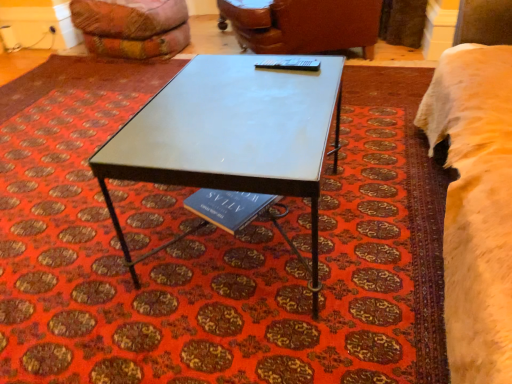
This screenshot has width=512, height=384. Identify the location of vacant area in front of metallic blue table tennis table at center. (298, 81).